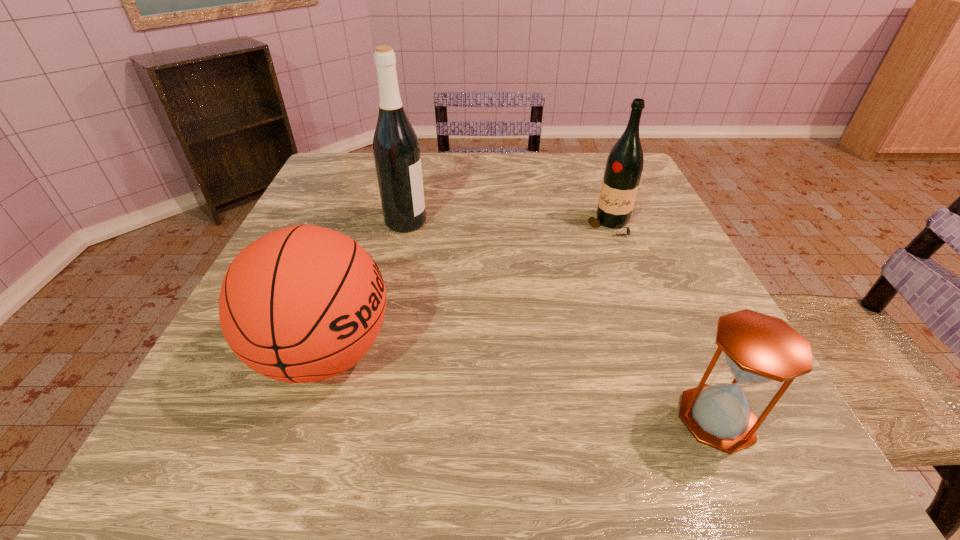
Find the location of a particular element. free space in the image that satisfies the following two spatial constraints: 1. on the front side of the shortest object; 2. on the right side of the shorter wine bottle is located at coordinates (684, 418).

Where is `vacant region that satisfies the following two spatial constraints: 1. on the side with logo of the third tallest object; 2. on the back side of the hourglass`? This screenshot has width=960, height=540. vacant region that satisfies the following two spatial constraints: 1. on the side with logo of the third tallest object; 2. on the back side of the hourglass is located at coordinates (302, 418).

Identify the location of blank space that satisfies the following two spatial constraints: 1. on the back side of the third shortest object; 2. on the label of the tallest object. The width and height of the screenshot is (960, 540). (608, 222).

I want to click on vacant position in the image that satisfies the following two spatial constraints: 1. on the label of the hourglass; 2. on the right side of the left wine bottle, so click(x=361, y=418).

Find the location of `vacant position in the image that satisfies the following two spatial constraints: 1. on the back side of the shortest object; 2. on the side with logo of the basketball`. vacant position in the image that satisfies the following two spatial constraints: 1. on the back side of the shortest object; 2. on the side with logo of the basketball is located at coordinates (687, 353).

What are the coordinates of `vacant space that satisfies the following two spatial constraints: 1. on the label of the left wine bottle; 2. on the right side of the hourglass` in the screenshot? It's located at (361, 418).

This screenshot has width=960, height=540. I want to click on free space that satisfies the following two spatial constraints: 1. on the label of the tallest object; 2. on the left side of the third shortest object, so click(x=405, y=226).

Identify the location of blank area in the image that satisfies the following two spatial constraints: 1. on the label of the left wine bottle; 2. on the back side of the hourglass. This screenshot has height=540, width=960. (361, 418).

Locate an element on the screen. The image size is (960, 540). vacant space that satisfies the following two spatial constraints: 1. on the side with logo of the hourglass; 2. on the left side of the basketball is located at coordinates (302, 418).

Where is `vacant space that satisfies the following two spatial constraints: 1. on the label of the taller wine bottle; 2. on the right side of the right wine bottle`? The height and width of the screenshot is (540, 960). vacant space that satisfies the following two spatial constraints: 1. on the label of the taller wine bottle; 2. on the right side of the right wine bottle is located at coordinates (405, 226).